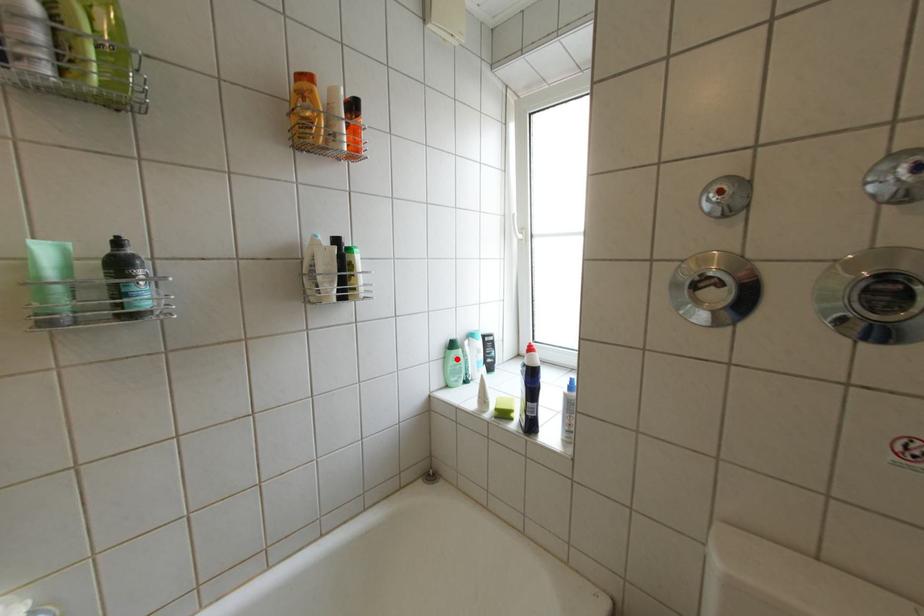
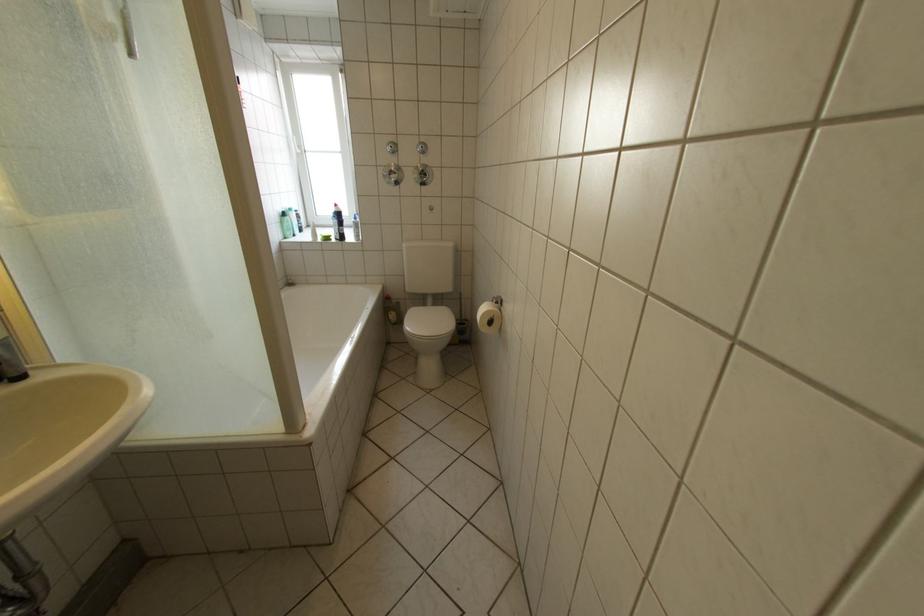
Question: I am providing you with two images of the same scene from different viewpoints. In image1, a red point is highlighted. Considering the same 3D point in image2, which of the following is correct?

Choices:
 (A) It is closer
 (B) It is farther

Answer: (A)